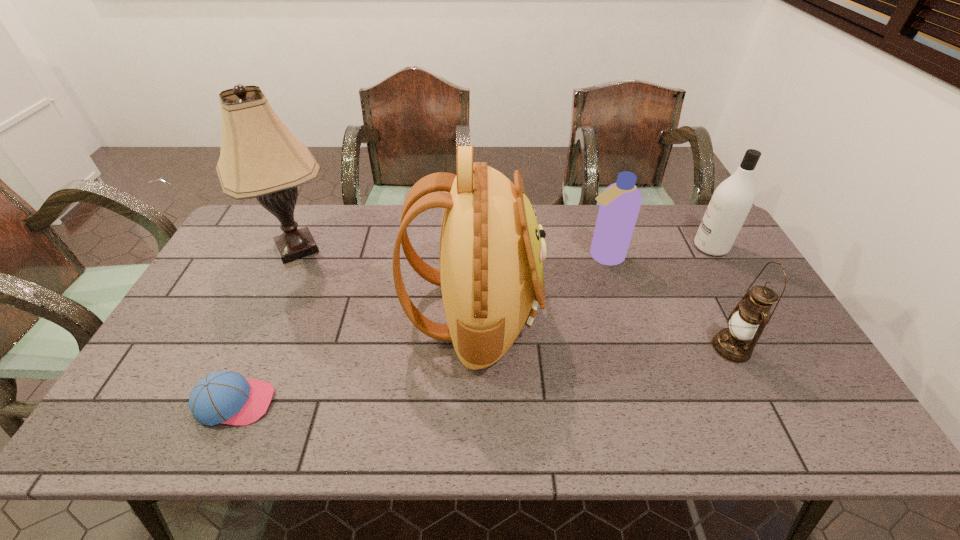
This screenshot has width=960, height=540. Identify the location of unoccupied position between the right shampoo and the fourth object from left to right. (657, 252).

Identify the location of free space that is in between the right shampoo and the third object from left to right. This screenshot has height=540, width=960. (592, 280).

What are the coordinates of `blank region between the oil lamp and the right shampoo` in the screenshot? It's located at (721, 298).

The height and width of the screenshot is (540, 960). In order to click on vacant area between the oil lamp and the shortest object in this screenshot , I will do `click(483, 375)`.

Locate an element on the screen. The height and width of the screenshot is (540, 960). vacant area between the right shampoo and the backpack is located at coordinates (592, 280).

The height and width of the screenshot is (540, 960). I want to click on free space between the lamp and the shortest object, so pyautogui.click(x=266, y=326).

Select which object is the closest to the shorter shampoo. Please provide its 2D coordinates. Your answer should be formatted as a tuple, i.e. [(x, y)], where the tuple contains the x and y coordinates of a point satisfying the conditions above.

[(492, 249)]

This screenshot has height=540, width=960. Find the location of `object that can be found as the closest to the shortest object`. object that can be found as the closest to the shortest object is located at coordinates (492, 249).

Identify the location of vacant area in the image that satisfies the following two spatial constraints: 1. on the front side of the left shampoo; 2. on the front-facing side of the baseball cap. Image resolution: width=960 pixels, height=540 pixels. (647, 403).

The width and height of the screenshot is (960, 540). I want to click on free spot that satisfies the following two spatial constraints: 1. on the front-facing side of the fourth object from right to left; 2. on the left side of the oil lamp, so click(473, 348).